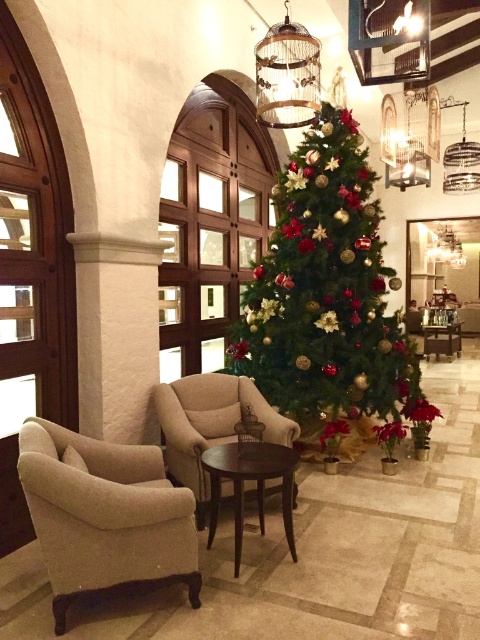
You are a guest in the hotel lobby and want to take a photo of both the shiny gold christmas tree at center and the beige fabric armchair at center. Which object will appear larger in your photo?

The shiny gold christmas tree at center will appear larger in the photo because it is bigger than the beige fabric armchair at center.

You are standing in the hotel lobby and want to sit down. There are two beige fabric armchairs in view. Which one is closer to you, the beige fabric armchair at left or the beige fabric armchair at center?

The beige fabric armchair at left is closer to you because it is positioned in front of the beige fabric armchair at center.